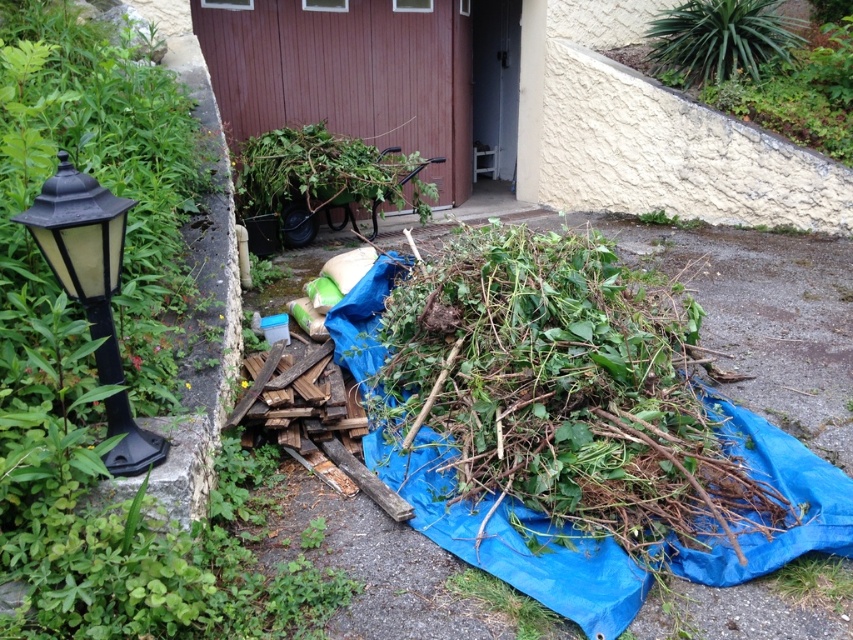
What object is located at the coordinate point (x=83, y=250) in the image?

The black plastic lamp post at left is located at coordinate point (x=83, y=250).